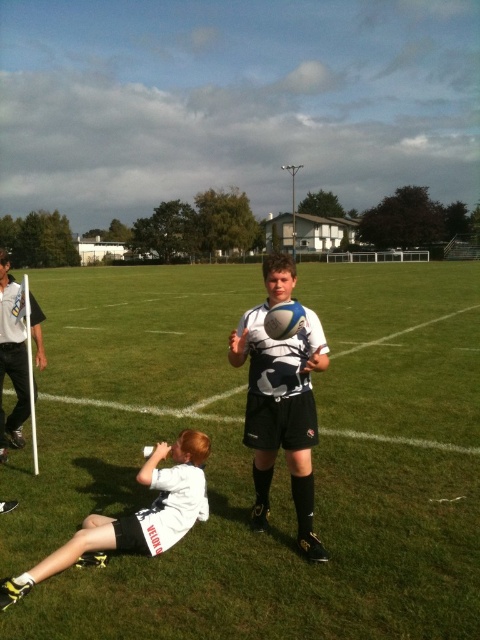
Between white matte rugby ball at center and white plastic flag at left, which one has more height?

With more height is white plastic flag at left.

Who is positioned more to the right, white matte rugby ball at center or white plastic flag at left?

From the viewer's perspective, white matte rugby ball at center appears more on the right side.

Who is more forward, (x=302, y=349) or (x=38, y=316)?

Point (x=302, y=349) is in front.

You are a GUI agent. You are given a task and a screenshot of the screen. Output one action in this format:
    pyautogui.click(x=<x>, y=<y>)
    Task: Click on the white matte rugby ball at center
    
    Given the screenshot: What is the action you would take?
    pyautogui.click(x=280, y=400)

Does green grass at center have a lesser height compared to white plastic flag at left?

Incorrect, green grass at center's height does not fall short of white plastic flag at left's.

Between point (433, 422) and point (15, 381), which one is positioned in front?

Point (15, 381)

What are the coordinates of `green grass at center` in the screenshot? It's located at (251, 460).

Is green grass at center shorter than white matte water bottle at lower left?

In fact, green grass at center may be taller than white matte water bottle at lower left.

Is green grass at center positioned behind white matte water bottle at lower left?

No, green grass at center is in front of white matte water bottle at lower left.

What are the coordinates of `green grass at center` in the screenshot? It's located at (251, 460).

Locate an element on the screen. The image size is (480, 640). green grass at center is located at coordinates (251, 460).